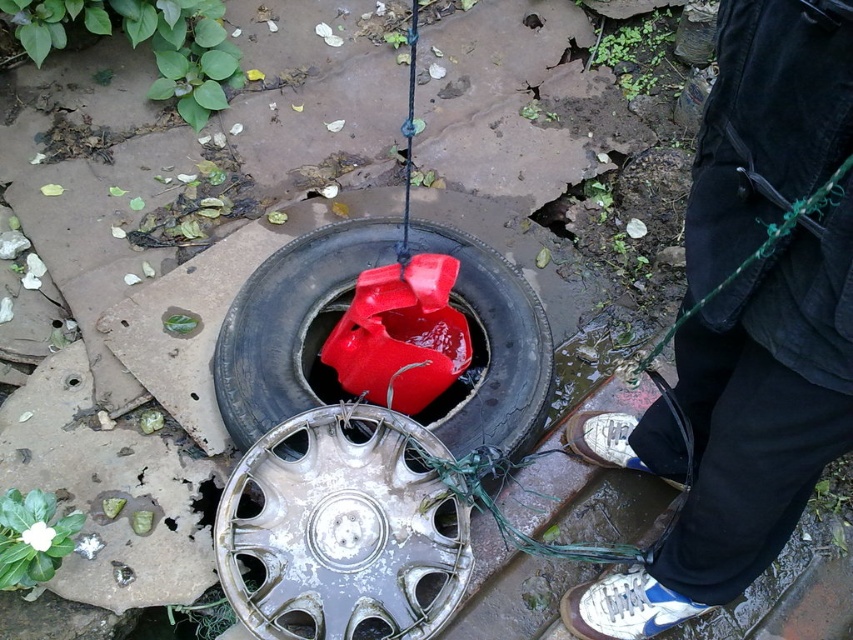
Who is positioned more to the left, dark blue jeans at lower right or glossy rubber tire at center?

From the viewer's perspective, glossy rubber tire at center appears more on the left side.

Can you confirm if dark blue jeans at lower right is positioned above glossy rubber tire at center?

Yes.

Where is `dark blue jeans at lower right`? The image size is (853, 640). dark blue jeans at lower right is located at coordinates (746, 429).

Locate an element on the screen. The image size is (853, 640). dark blue jeans at lower right is located at coordinates (746, 429).

Is silver metallic hubcap at center taller than glossy rubber tire at center?

No, silver metallic hubcap at center is not taller than glossy rubber tire at center.

The image size is (853, 640). Identify the location of silver metallic hubcap at center. 343,531.

The height and width of the screenshot is (640, 853). I want to click on silver metallic hubcap at center, so click(x=343, y=531).

Is point (846, 438) positioned behind point (299, 580)?

No, it is in front of (299, 580).

Identify the location of dark blue jeans at lower right. (746, 429).

The width and height of the screenshot is (853, 640). In order to click on dark blue jeans at lower right in this screenshot , I will do `click(746, 429)`.